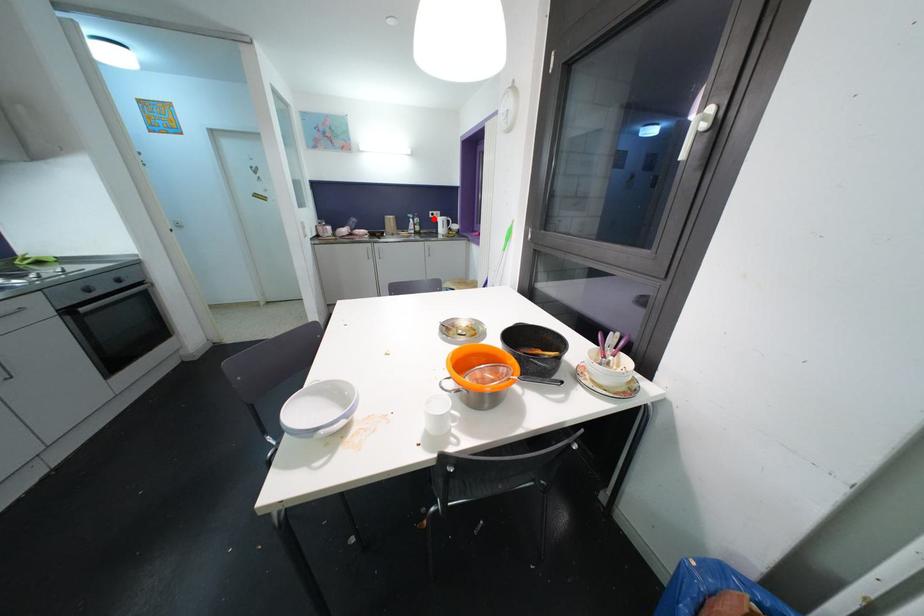
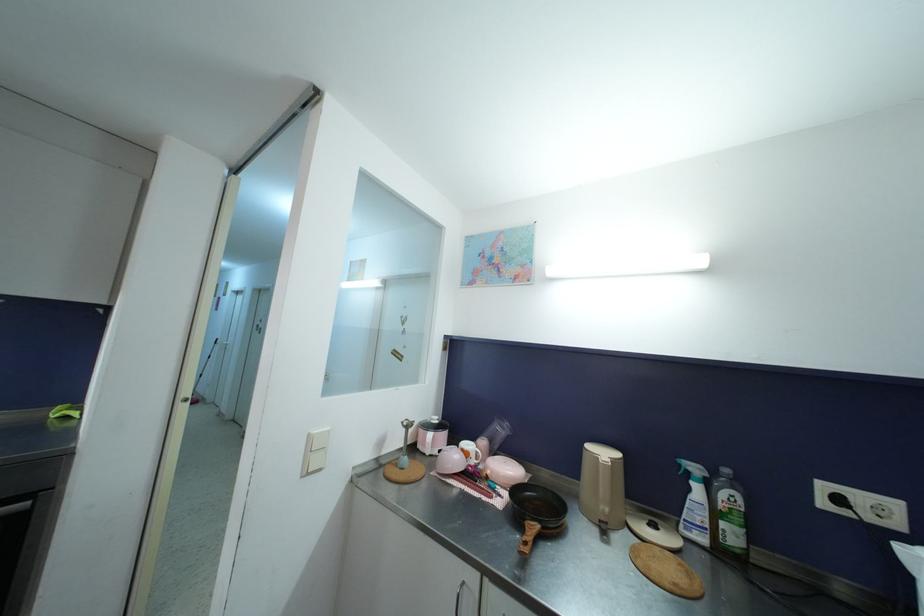
Question: I am providing you with two images of the same scene from different viewpoints. Image1 has a red point marked. In image2, the corresponding 3D location appears at what relative position? Reply with the corresponding letter.

Choices:
 (A) Closer
 (B) Farther

Answer: (B)